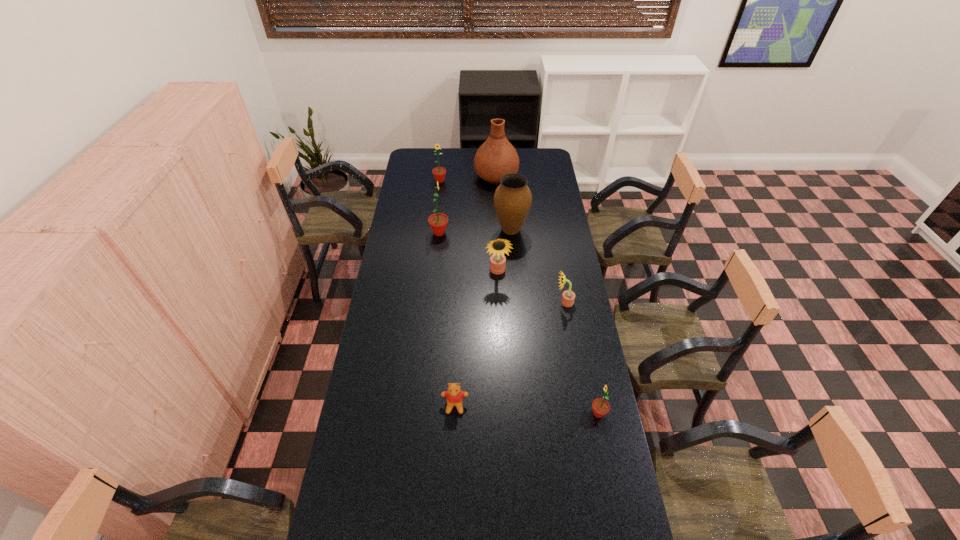
Identify the location of vacant space located on the face of the fourth nearest object. Image resolution: width=960 pixels, height=540 pixels. (499, 307).

This screenshot has height=540, width=960. I want to click on vacant space located on the face of the third nearest object, so click(x=530, y=302).

At what (x,y) coordinates should I click in order to perform the action: click on free space located 0.390m on the face of the third nearest object. Please return your answer as a coordinate pair (x, y). The width and height of the screenshot is (960, 540). Looking at the image, I should click on (x=464, y=302).

Identify the location of vacant space positioned on the face of the third nearest object. This screenshot has height=540, width=960. (496, 302).

I want to click on vacant space located on the face of the nearest green sunflower, so click(x=546, y=413).

Where is `vacant space located 0.320m on the face of the nearest green sunflower`? vacant space located 0.320m on the face of the nearest green sunflower is located at coordinates (497, 413).

Locate an element on the screen. The image size is (960, 540). vacant point located on the face of the nearest green sunflower is located at coordinates (474, 413).

Locate an element on the screen. vacant space located on the front-facing side of the shortest object is located at coordinates (452, 462).

The width and height of the screenshot is (960, 540). I want to click on object that is at the far edge, so click(x=496, y=157).

This screenshot has height=540, width=960. In the image, there is a desktop. In order to click on free region at the far edge in this screenshot , I will do `click(462, 165)`.